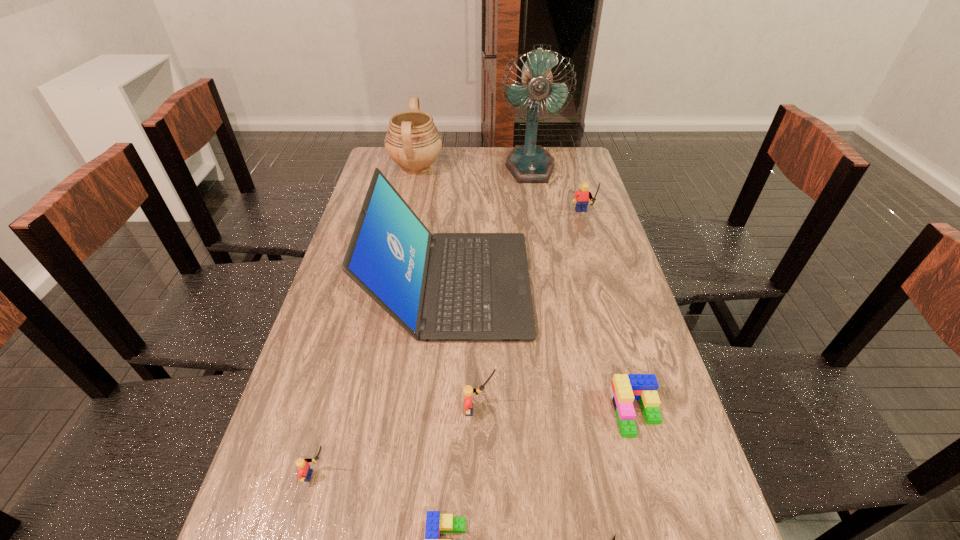
Find the location of a particular element. This screenshot has width=960, height=540. vacant position at the right edge of the desktop is located at coordinates (652, 471).

You are a GUI agent. You are given a task and a screenshot of the screen. Output one action in this format:
    pyautogui.click(x=<x>, y=<y>)
    Task: Click on the vacant space at the far left corner
    The width and height of the screenshot is (960, 540).
    Given the screenshot: What is the action you would take?
    pyautogui.click(x=386, y=151)

Where is `vacant space at the far right corner of the desktop`? The width and height of the screenshot is (960, 540). vacant space at the far right corner of the desktop is located at coordinates (553, 154).

Identify the location of vacant space that is in between the farther green Lego and the rightmost yellow Lego. This screenshot has height=540, width=960. (610, 313).

At what (x,y) coordinates should I click in order to perform the action: click on free space between the nearest yellow Lego and the gray laptop computer. Please return your answer as a coordinate pair (x, y). Image resolution: width=960 pixels, height=540 pixels. Looking at the image, I should click on (385, 380).

Identify the location of free space between the rightmost yellow Lego and the fourth shortest object. (450, 345).

Find the location of a particular element. unoccupied position between the tallest object and the farthest yellow Lego is located at coordinates (557, 191).

You are a GUI agent. You are given a task and a screenshot of the screen. Output one action in this format:
    pyautogui.click(x=<x>, y=<y>)
    Task: Click on the object that stands as the third closest to the second nearest yellow Lego
    
    Given the screenshot: What is the action you would take?
    pyautogui.click(x=613, y=539)

Select which object is the seventh closest to the pen. Please provide its 2D coordinates. Your answer should be formatted as a tuple, i.e. [(x, y)], where the tuple contains the x and y coordinates of a point satisfying the conditions above.

[(530, 163)]

Identify which Lego is the second nearest to the fifth shortest object. Please provide its 2D coordinates. Your answer should be formatted as a tuple, i.e. [(x, y)], where the tuple contains the x and y coordinates of a point satisfying the conditions above.

[(625, 388)]